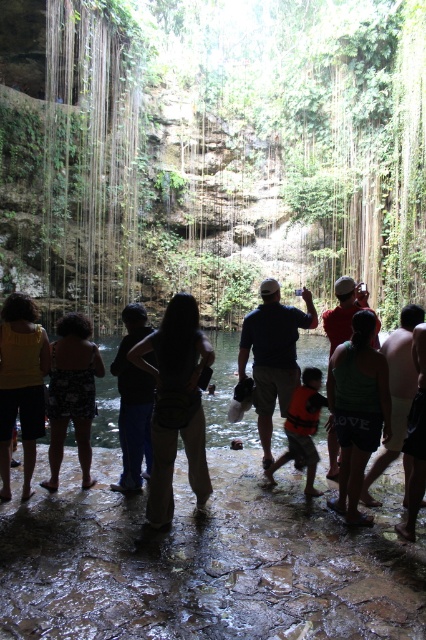
Can you confirm if matte khaki pants at center is bigger than tan skin person at center?

Indeed, matte khaki pants at center has a larger size compared to tan skin person at center.

The width and height of the screenshot is (426, 640). Describe the element at coordinates (175, 403) in the screenshot. I see `matte khaki pants at center` at that location.

Between point (166, 426) and point (377, 467), which one is positioned behind?

Point (377, 467)

Where is `matte khaki pants at center`? matte khaki pants at center is located at coordinates (175, 403).

Can you confirm if dark blue shirt at center is taller than tan skin person at center?

Indeed, dark blue shirt at center has a greater height compared to tan skin person at center.

Between dark blue shirt at center and tan skin person at center, which one has more height?

dark blue shirt at center is taller.

Who is more forward, (265,333) or (412,310)?

Point (412,310) is more forward.

Where is `dark blue shirt at center`? This screenshot has width=426, height=640. dark blue shirt at center is located at coordinates (273, 355).

Is matte black shorts at left bigger than dark blue shirt at center?

No.

Can you confirm if matte black shorts at left is shorter than dark blue shirt at center?

Indeed, matte black shorts at left has a lesser height compared to dark blue shirt at center.

Identify the location of matte black shorts at left. (20, 385).